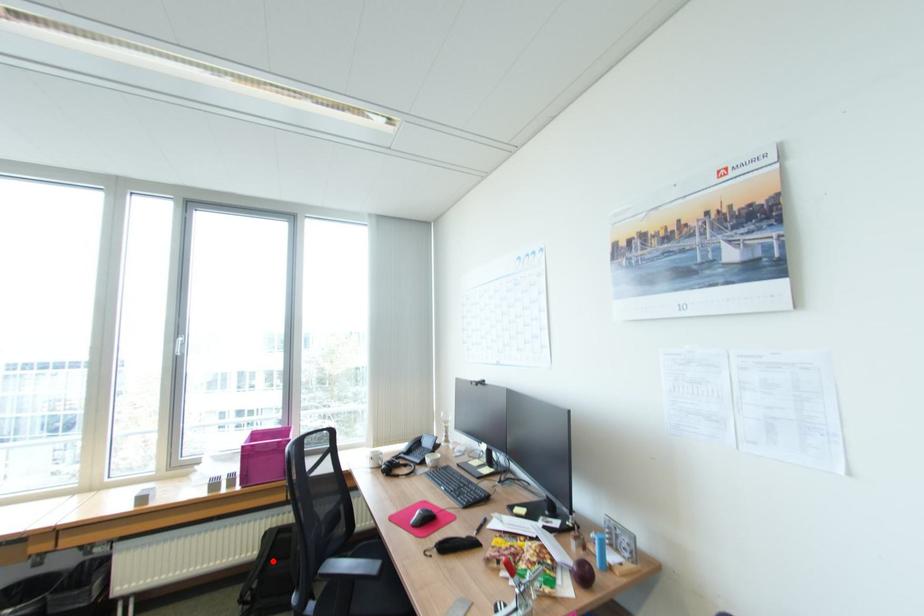
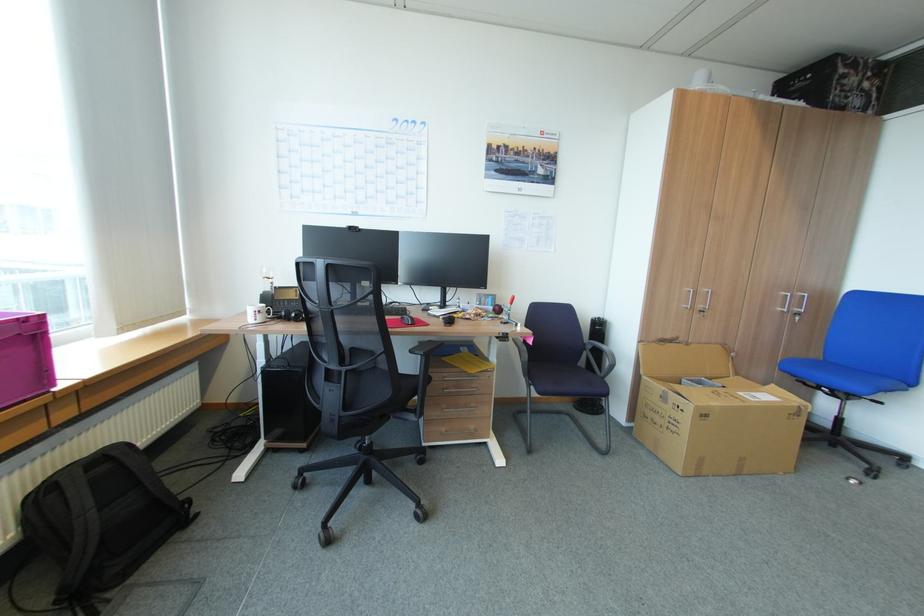
Question: I am providing you with two images of the same scene from different viewpoints. A red point is shown in image1. For the corresponding object point in image2, is it positioned nearer or farther from the camera?

Choices:
 (A) Nearer
 (B) Farther

Answer: (A)